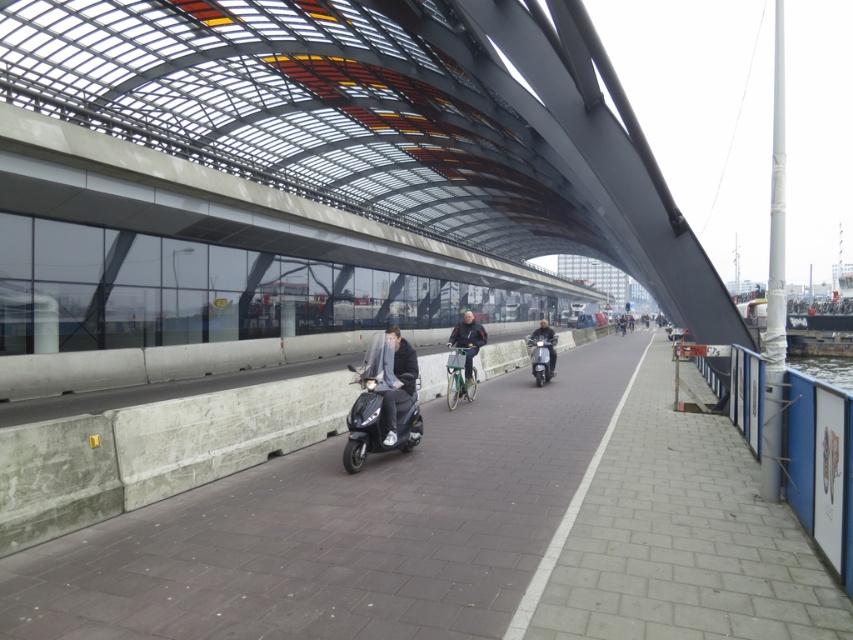
Question: Considering the real-world distances, which object is closest to the shiny black scooter at center?

Choices:
 (A) smooth concrete sidewalk at center
 (B) black matte scooter at center
 (C) metallic silver bicycle at center

Answer: (C)

Question: Which point is farther to the camera?

Choices:
 (A) smooth concrete sidewalk at center
 (B) metallic silver bicycle at center
 (C) shiny black scooter at center

Answer: (C)

Question: Which of these objects is positioned closest to the smooth concrete sidewalk at center?

Choices:
 (A) metallic silver bicycle at center
 (B) matte black scooter at center

Answer: (B)

Question: Is smooth concrete sidewalk at center thinner than matte black scooter at center?

Choices:
 (A) yes
 (B) no

Answer: (B)

Question: From the image, what is the correct spatial relationship of black matte scooter at center in relation to matte black scooter at center?

Choices:
 (A) below
 (B) above

Answer: (A)

Question: Is matte black scooter at center positioned behind shiny black scooter at center?

Choices:
 (A) no
 (B) yes

Answer: (A)